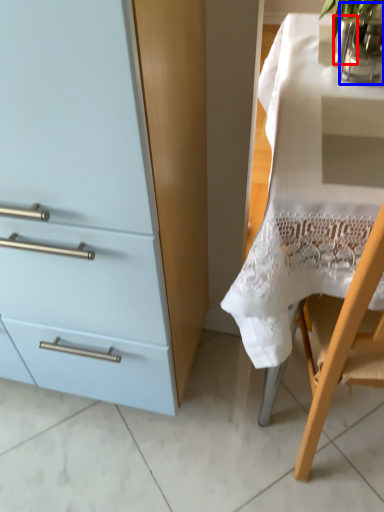
Question: Which object is further to the camera taking this photo, glass vase (highlighted by a red box) or glass vase (highlighted by a blue box)?

Choices:
 (A) glass vase
 (B) glass vase

Answer: (A)